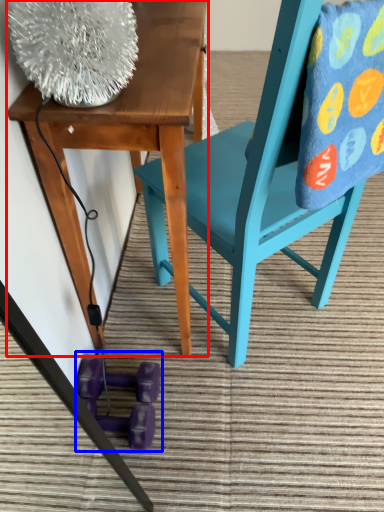
Question: Which object appears closest to the camera in this image, table (highlighted by a red box) or toy (highlighted by a blue box)?

Choices:
 (A) table
 (B) toy

Answer: (A)